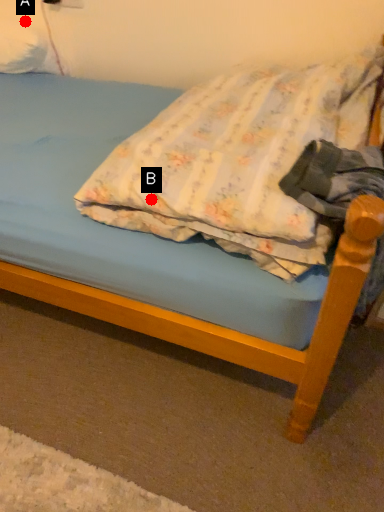
Question: Two points are circled on the image, labeled by A and B beside each circle. Which point is farther from the camera taking this photo?

Choices:
 (A) A is further
 (B) B is further

Answer: (A)